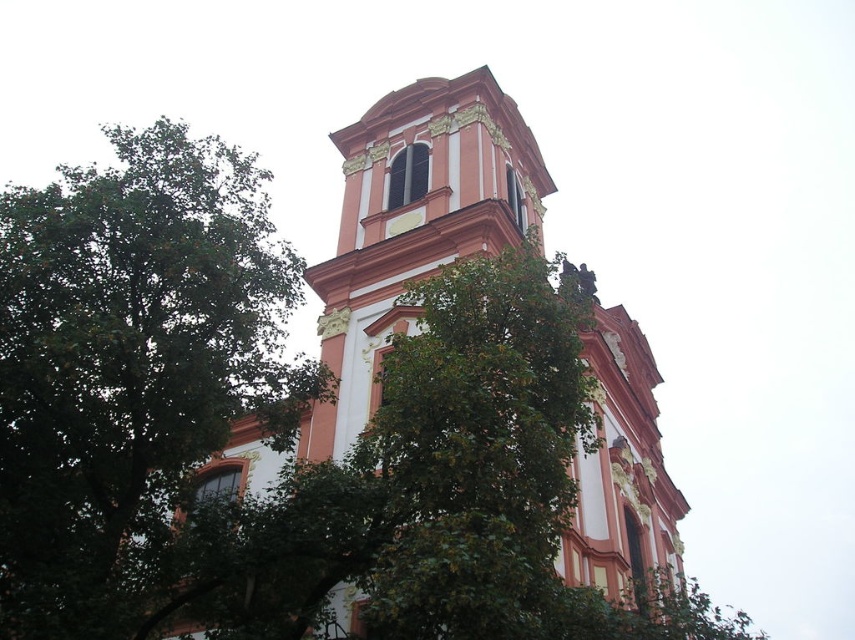
Who is more forward, (12, 275) or (637, 401)?

Point (12, 275)

Is green leafy tree at center above matte orange church at center?

Yes.

Between point (98, 568) and point (463, 179), which one is positioned behind?

The point (463, 179) is more distant.

Where is `green leafy tree at center`? Image resolution: width=855 pixels, height=640 pixels. green leafy tree at center is located at coordinates (130, 368).